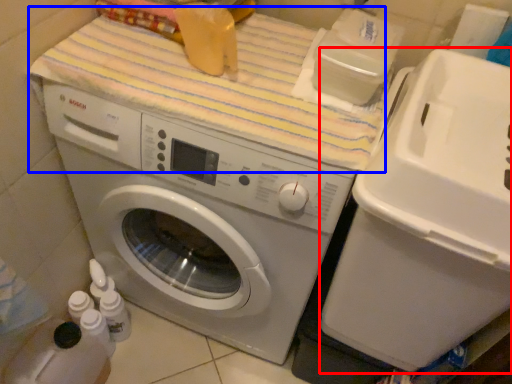
Question: Which object is further to the camera taking this photo, water cooler (highlighted by a red box) or bath towel (highlighted by a blue box)?

Choices:
 (A) water cooler
 (B) bath towel

Answer: (B)